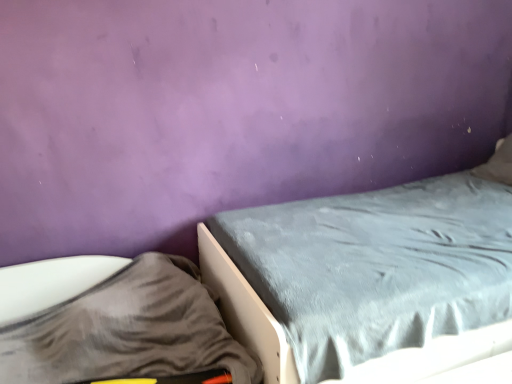
Question: From a real-world perspective, is velvet gray bed at center physically located above or below gray fabric sheet at lower left?

Choices:
 (A) above
 (B) below

Answer: (A)

Question: Do you think velvet gray bed at center is within gray fabric sheet at lower left, or outside of it?

Choices:
 (A) inside
 (B) outside

Answer: (B)

Question: Considering their positions, is velvet gray bed at center located in front of or behind gray fabric sheet at lower left?

Choices:
 (A) front
 (B) behind

Answer: (B)

Question: From their relative heights in the image, would you say gray fabric sheet at lower left is taller or shorter than velvet gray bed at center?

Choices:
 (A) short
 (B) tall

Answer: (A)

Question: From the image's perspective, is gray fabric sheet at lower left located above or below velvet gray bed at center?

Choices:
 (A) below
 (B) above

Answer: (A)

Question: Considering the positions of gray fabric sheet at lower left and velvet gray bed at center in the image, is gray fabric sheet at lower left wider or thinner than velvet gray bed at center?

Choices:
 (A) thin
 (B) wide

Answer: (A)

Question: Is point (97, 347) positioned closer to the camera than point (225, 276)?

Choices:
 (A) farther
 (B) closer

Answer: (B)